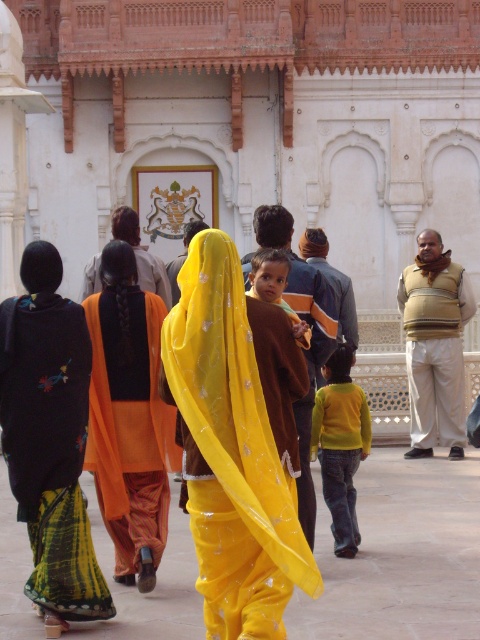
Looking at this image, does yellow satin sari at center lie behind black embroidered sari at left?

No, it is not.

Who is lower down, yellow satin sari at center or black embroidered sari at left?

black embroidered sari at left is lower down.

In order to click on yellow satin sari at center in this screenshot , I will do `click(230, 452)`.

Can you confirm if yellow-green sweater at center is thinner than matte brown shirt at center?

No, yellow-green sweater at center is not thinner than matte brown shirt at center.

Can you confirm if yellow-green sweater at center is shorter than matte brown shirt at center?

No.

Who is more forward, (338, 556) or (290, 316)?

Point (290, 316) is in front.

Find the location of a particular element. This screenshot has height=640, width=480. yellow-green sweater at center is located at coordinates (340, 445).

Who is more distant from viewer, [157,499] or [262,296]?

Point [262,296]

Is point (87, 452) less distant than point (261, 276)?

Yes, it is in front of point (261, 276).

Locate an element on the screen. The height and width of the screenshot is (640, 480). orange fabric dress at center is located at coordinates (129, 417).